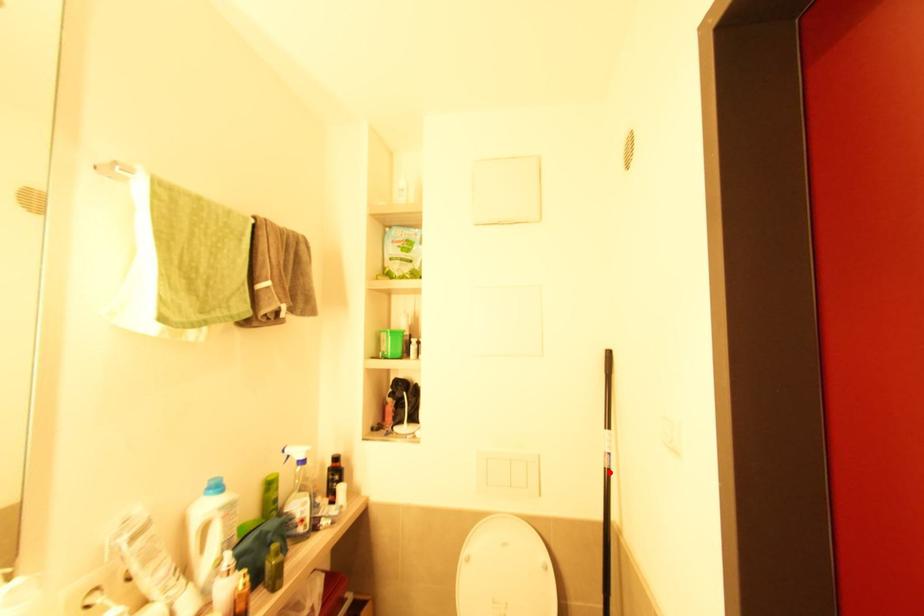
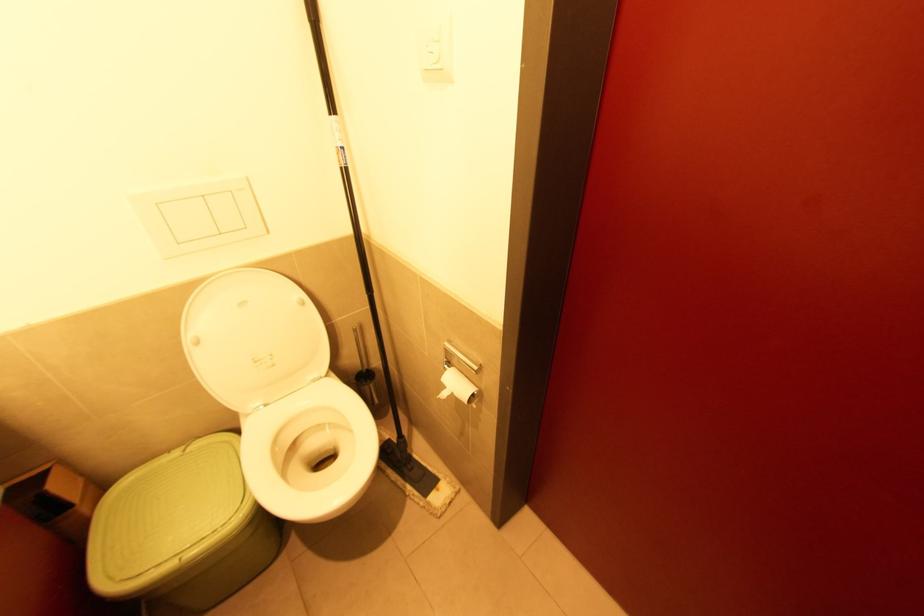
Where in the second image is the point corresponding to the highlighted location from the first image?

(347, 172)